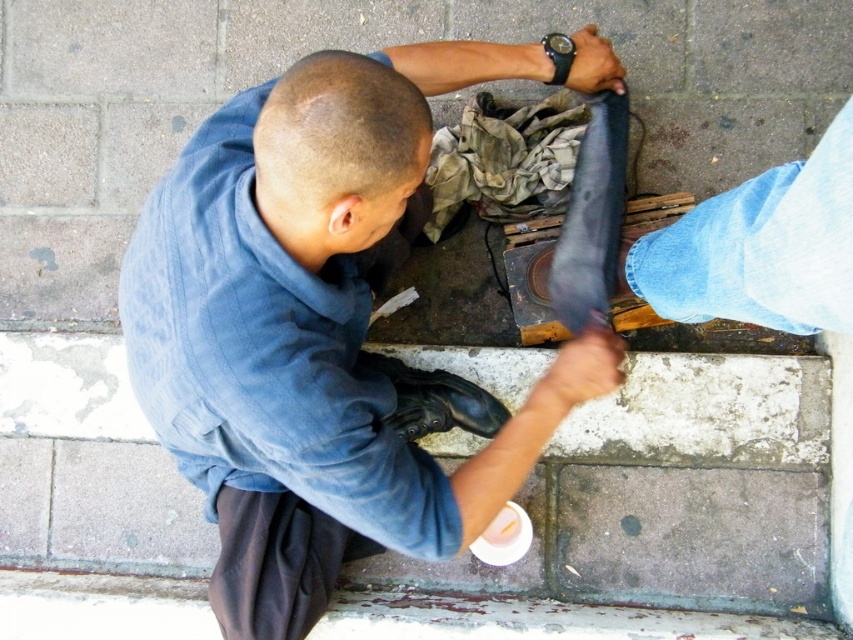
Question: Is black leather shoe at lower center above black leather shoe at upper center?

Choices:
 (A) no
 (B) yes

Answer: (A)

Question: Which of the following is the closest to the observer?

Choices:
 (A) (207, 134)
 (B) (555, 356)

Answer: (A)

Question: Which is farther from the smooth leather shoe at lower center?

Choices:
 (A) denim jacket at center
 (B) black leather shoe at upper center

Answer: (B)

Question: Which of these objects is positioned farthest from the black leather shoe at upper center?

Choices:
 (A) smooth leather shoe at lower center
 (B) black leather shoe at lower center
 (C) denim jacket at center

Answer: (B)

Question: Can you confirm if black leather shoe at lower center is positioned below smooth leather shoe at lower center?

Choices:
 (A) yes
 (B) no

Answer: (A)

Question: Can you confirm if smooth leather shoe at lower center is wider than black leather shoe at upper center?

Choices:
 (A) yes
 (B) no

Answer: (A)